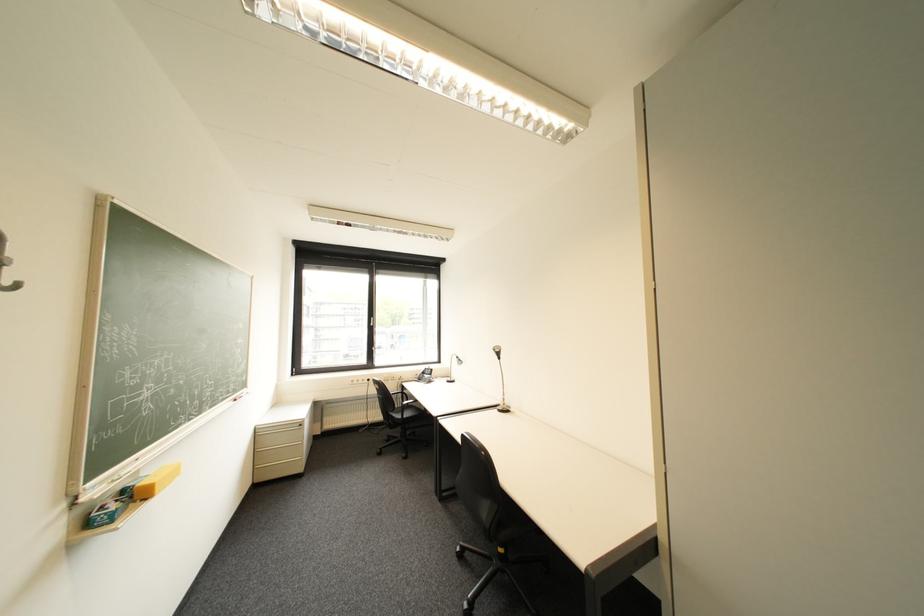
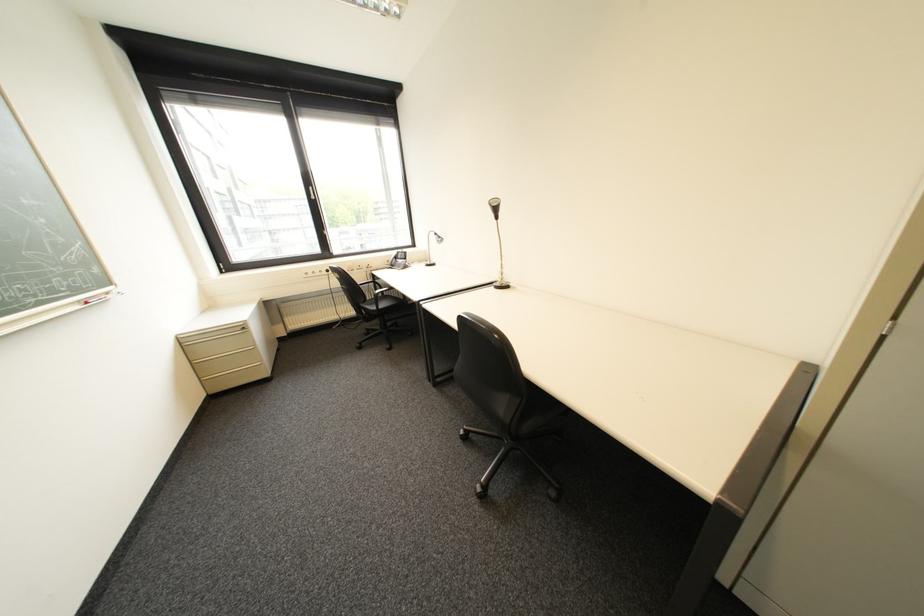
Question: In a continuous first-person perspective shot, in which direction is the camera moving?

Choices:
 (A) Left
 (B) Right
 (C) Forward
 (D) Backward

Answer: (C)